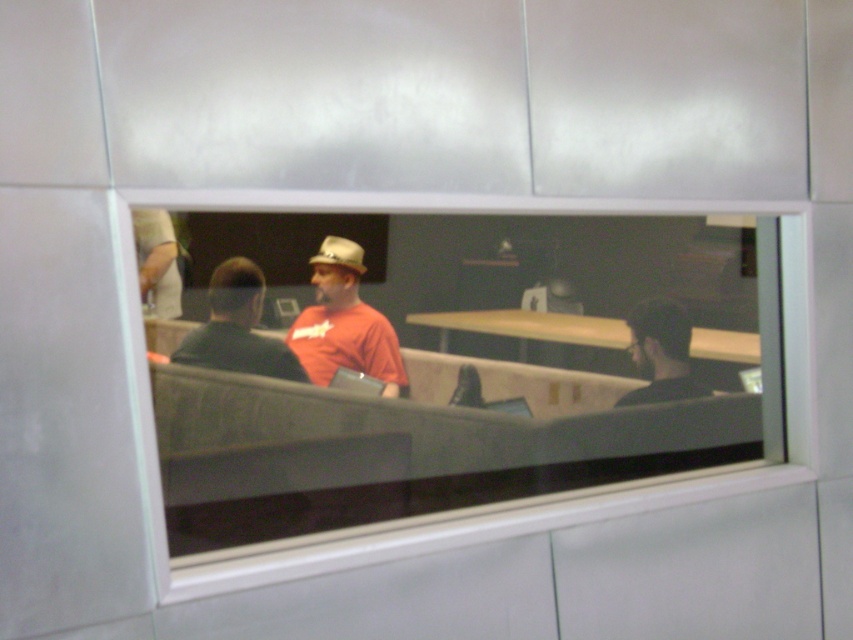
Does matte orange shirt at center come in front of black matte shirt at left?

No, it is not.

Based on the photo, between matte orange shirt at center and black matte shirt at left, which one has less height?

Standing shorter between the two is black matte shirt at left.

Is point (373, 316) closer to camera compared to point (189, 348)?

No, it is behind (189, 348).

This screenshot has height=640, width=853. Find the location of `matte orange shirt at center`. matte orange shirt at center is located at coordinates (344, 323).

Is matte orange shirt at center to the left of light brown felt cowboy hat at center from the viewer's perspective?

In fact, matte orange shirt at center is to the right of light brown felt cowboy hat at center.

Does matte orange shirt at center have a greater height compared to light brown felt cowboy hat at center?

Yes.

Who is more distant from viewer, (370, 328) or (344, 241)?

The point (344, 241) is behind.

Where is `matte orange shirt at center`? This screenshot has width=853, height=640. matte orange shirt at center is located at coordinates (344, 323).

Is matte orange shirt at center above wooden at center?

Yes, matte orange shirt at center is above wooden at center.

Which of these two, matte orange shirt at center or wooden at center, stands taller?

With more height is matte orange shirt at center.

Who is more forward, (387, 376) or (480, 317)?

Point (387, 376) is in front.

Image resolution: width=853 pixels, height=640 pixels. I want to click on matte orange shirt at center, so click(x=344, y=323).